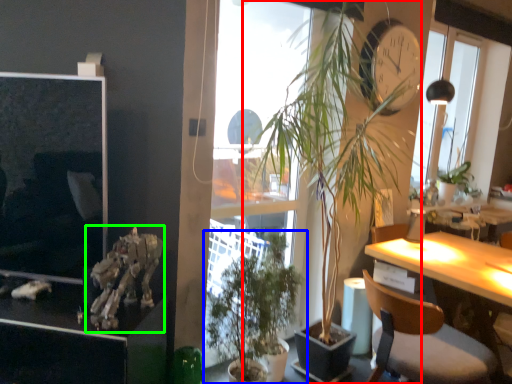
Question: Which object is the farthest from houseplant (highlighted by a red box)? Choose among these: houseplant (highlighted by a blue box) or skeleton (highlighted by a green box).

Choices:
 (A) houseplant
 (B) skeleton

Answer: (B)